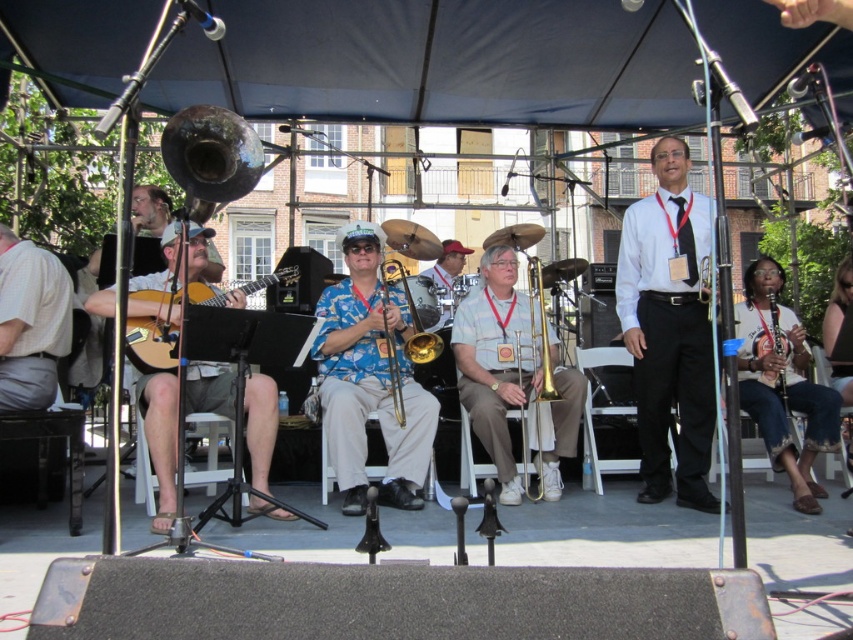
The image size is (853, 640). Describe the element at coordinates (669, 330) in the screenshot. I see `black matte tie at center` at that location.

The image size is (853, 640). Identify the location of black matte tie at center. (669, 330).

Which is in front, point (625, 333) or point (279, 509)?

Point (279, 509)

Locate an element on the screen. black matte tie at center is located at coordinates (669, 330).

Is blue floral shirt at center positioned at the back of acoustic guitar at left?

Yes.

Is blue floral shirt at center above acoustic guitar at left?

Yes, blue floral shirt at center is above acoustic guitar at left.

Between point (370, 408) and point (260, 397), which one is positioned behind?

The point (370, 408) is more distant.

Locate an element on the screen. The image size is (853, 640). blue floral shirt at center is located at coordinates (370, 378).

Which is behind, point (648, 259) or point (434, 356)?

Positioned behind is point (434, 356).

Is point (654, 429) positioned behind point (430, 342)?

No, (654, 429) is closer to viewer.

This screenshot has width=853, height=640. Identify the location of black matte tie at center. (669, 330).